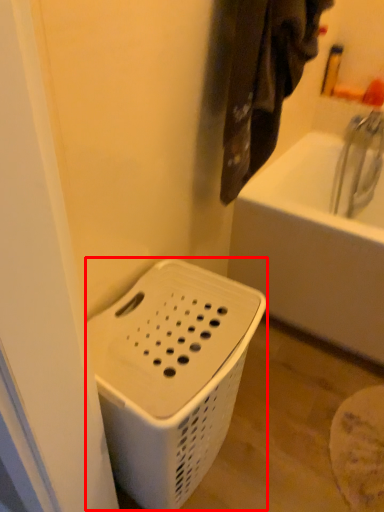
Question: From the image's perspective, where is basket container (annotated by the red box) located in relation to laundry in the image?

Choices:
 (A) above
 (B) below

Answer: (B)